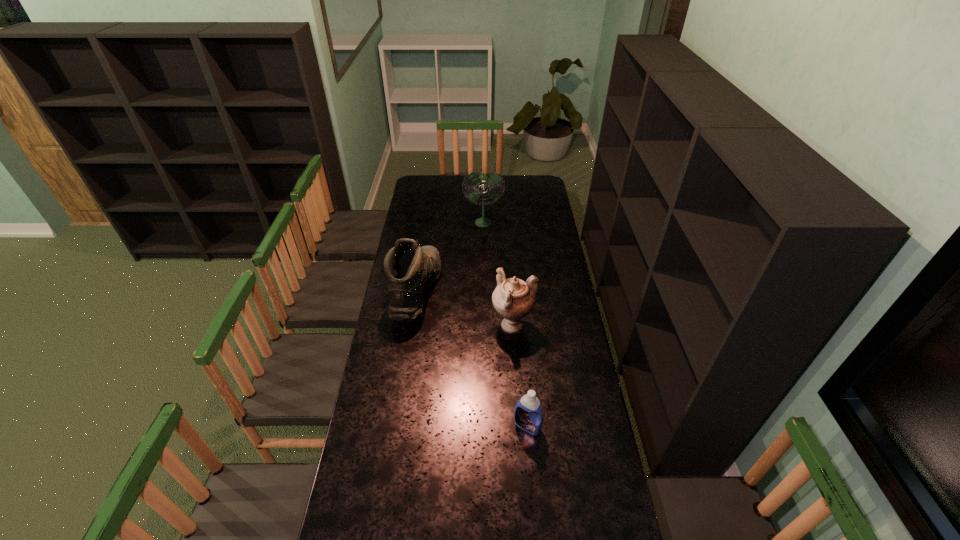
Where is `free space at the left edge of the desktop`? This screenshot has width=960, height=540. free space at the left edge of the desktop is located at coordinates (413, 211).

Where is `free space at the right edge of the desktop`? free space at the right edge of the desktop is located at coordinates (603, 433).

Where is `vacant position at the far left corner of the desktop`? vacant position at the far left corner of the desktop is located at coordinates pos(420,177).

At what (x,y) coordinates should I click in order to perform the action: click on unoccupied position between the detergent and the leftmost object. Please return your answer as a coordinate pair (x, y). Looking at the image, I should click on (472, 359).

Where is `free point between the urn and the shortest object`? This screenshot has width=960, height=540. free point between the urn and the shortest object is located at coordinates (520, 376).

This screenshot has height=540, width=960. In order to click on blank region between the ski boot and the urn in this screenshot , I will do `click(465, 309)`.

Choose which object is the second nearest neighbor to the leftmost object. Please provide its 2D coordinates. Your answer should be formatted as a tuple, i.e. [(x, y)], where the tuple contains the x and y coordinates of a point satisfying the conditions above.

[(483, 183)]

Identify the location of object that is the closest one to the detergent. (513, 299).

Where is `vacant point that satisfies the following two spatial constraints: 1. on the front side of the urn; 2. on the left side of the detergent`? Image resolution: width=960 pixels, height=540 pixels. vacant point that satisfies the following two spatial constraints: 1. on the front side of the urn; 2. on the left side of the detergent is located at coordinates (520, 426).

At what (x,y) coordinates should I click in order to perform the action: click on vacant space that satisfies the following two spatial constraints: 1. on the front-facing side of the detergent; 2. on the left side of the fan. Please return your answer as a coordinate pair (x, y). The width and height of the screenshot is (960, 540). Looking at the image, I should click on (485, 426).